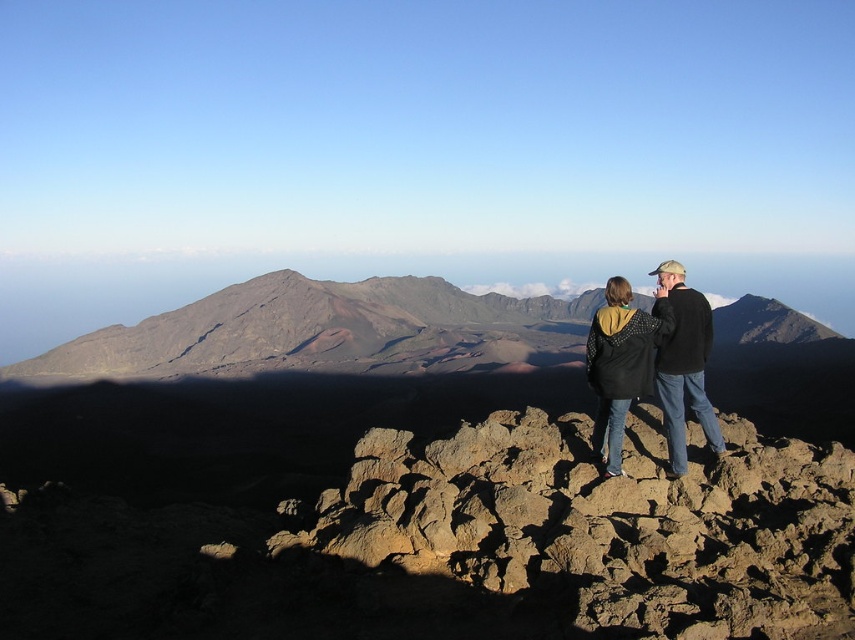
Between brown rough rocks at center and rustic brown mountain at center, which one has more height?

Standing taller between the two is rustic brown mountain at center.

You are a GUI agent. You are given a task and a screenshot of the screen. Output one action in this format:
    pyautogui.click(x=<x>, y=<y>)
    Task: Click on the brown rough rocks at center
    This screenshot has width=855, height=640.
    Given the screenshot: What is the action you would take?
    pyautogui.click(x=606, y=525)

Does point (795, 461) come in front of point (522, 332)?

Yes.

The image size is (855, 640). Find the location of `brown rough rocks at center`. brown rough rocks at center is located at coordinates (606, 525).

Between rustic brown mountain at center and black jacket at center, which one is positioned lower?

black jacket at center is lower down.

Between rustic brown mountain at center and black jacket at center, which one is positioned higher?

rustic brown mountain at center is higher up.

Does point (774, 320) lie behind point (611, 442)?

Yes, point (774, 320) is behind point (611, 442).

Where is `rustic brown mountain at center`? This screenshot has width=855, height=640. rustic brown mountain at center is located at coordinates (311, 326).

Is brown rough rocks at center wider than black jacket at center?

Yes.

Looking at this image, does brown rough rocks at center have a smaller size compared to black jacket at center?

No.

What do you see at coordinates (606, 525) in the screenshot? I see `brown rough rocks at center` at bounding box center [606, 525].

At what (x,y) coordinates should I click in order to perform the action: click on brown rough rocks at center. Please return your answer as a coordinate pair (x, y). This screenshot has height=640, width=855. Looking at the image, I should click on (606, 525).